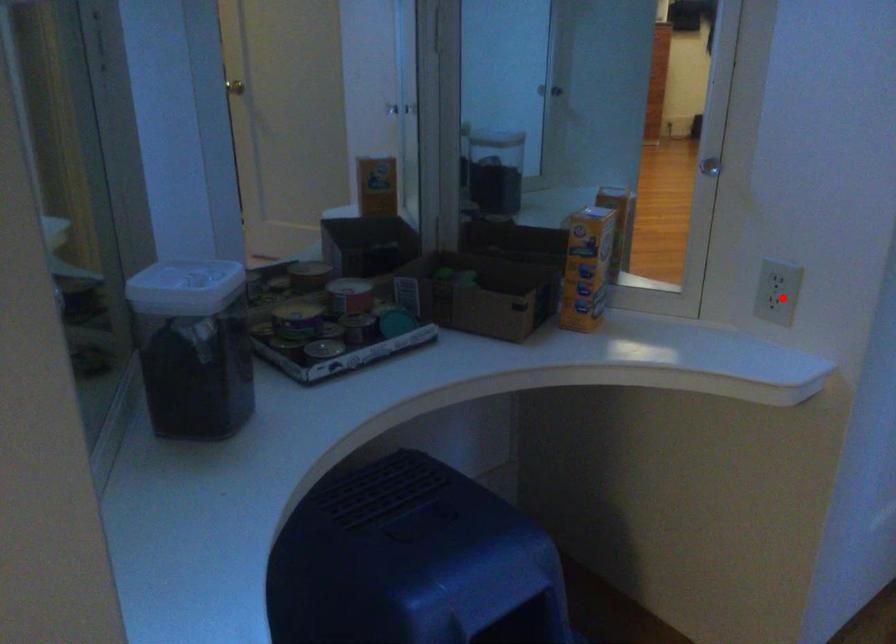
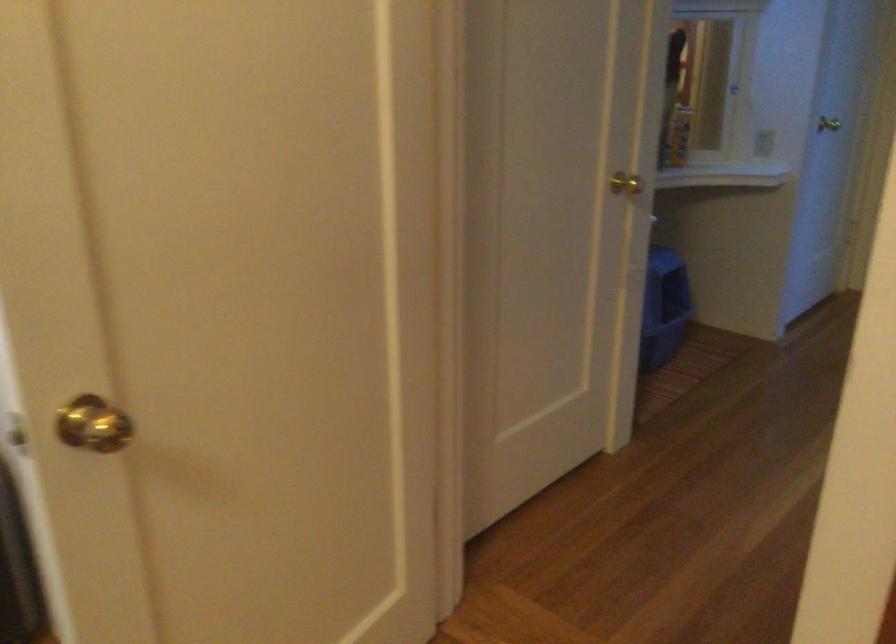
In the second image, find the point that corresponds to the highlighted location in the first image.

(762, 143)